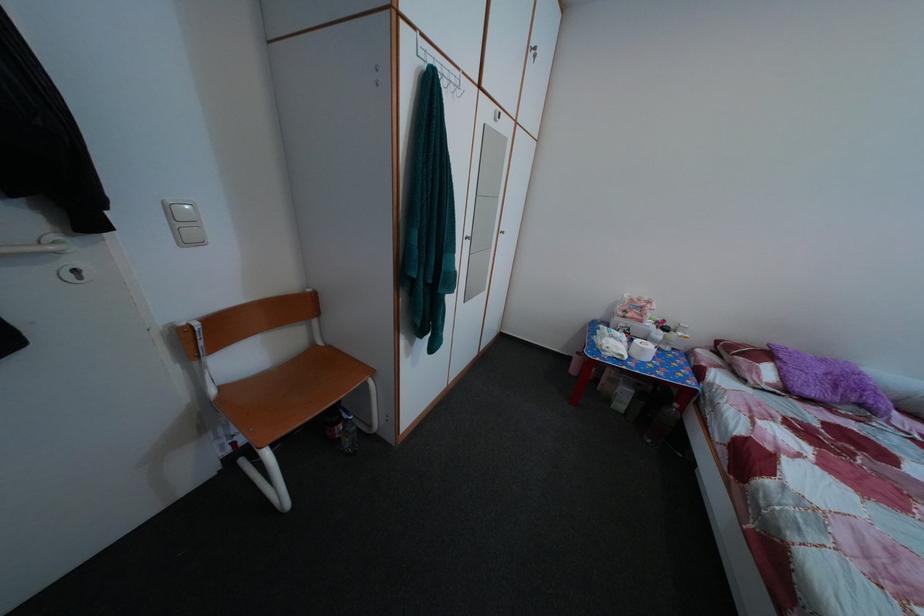
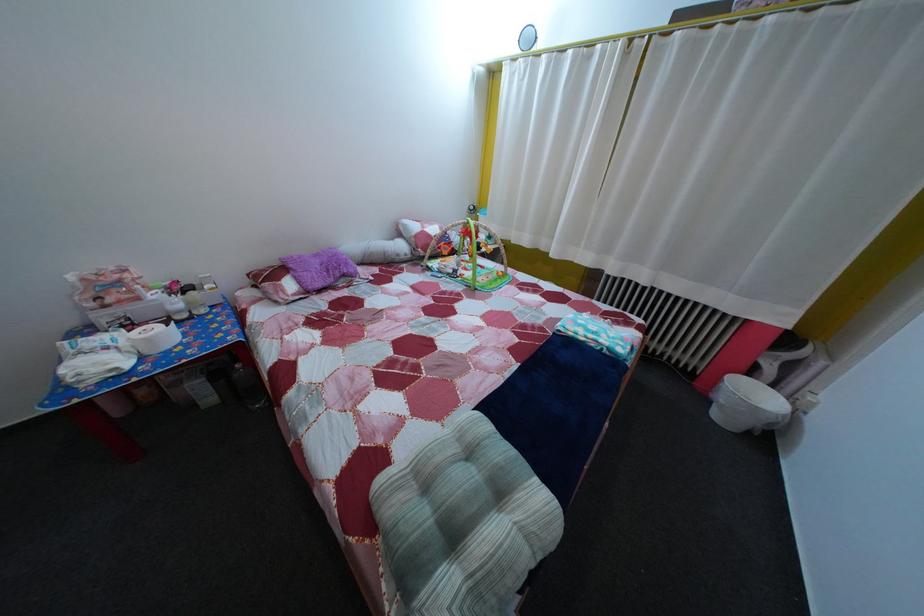
Find the pixel in the second image that matches [832,369] in the first image.

(325, 262)